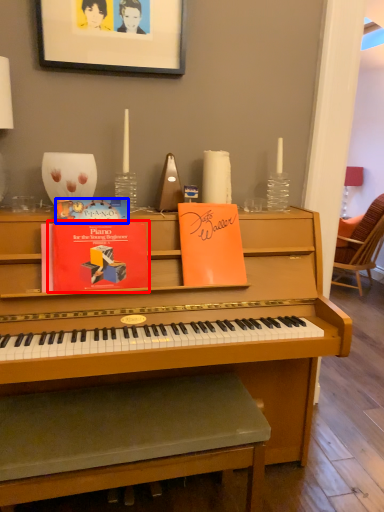
Question: Which of the following is the farthest to the observer, paperback book (highlighted by a red box) or paperback book (highlighted by a blue box)?

Choices:
 (A) paperback book
 (B) paperback book

Answer: (B)